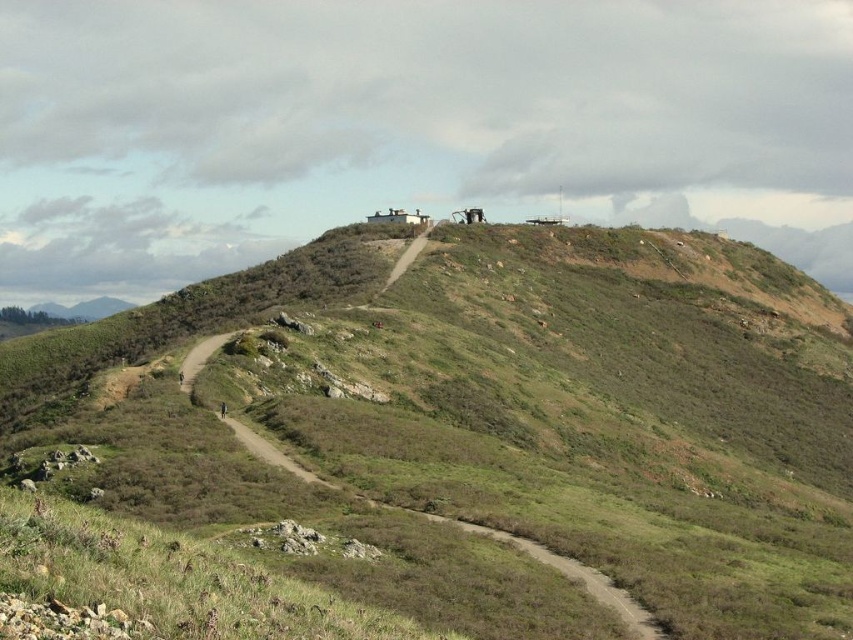
Question: Estimate the real-world distances between objects in this image. Which object is closer to the brown leather jacket at lower left?

Choices:
 (A) green grassy hill at upper center
 (B) black fabric person at lower left

Answer: (B)

Question: Which object is the farthest from the green grassy hill at upper center?

Choices:
 (A) black fabric person at lower left
 (B) brown dirt trail at center

Answer: (A)

Question: Which object is the farthest from the brown leather jacket at lower left?

Choices:
 (A) green grassy hill at upper center
 (B) black fabric person at lower left

Answer: (A)

Question: Does green grassy hill at upper center lie behind brown leather jacket at lower left?

Choices:
 (A) yes
 (B) no

Answer: (B)

Question: From the image, what is the correct spatial relationship of green grassy hill at upper center in relation to black fabric person at lower left?

Choices:
 (A) right
 (B) left

Answer: (A)

Question: Does black fabric person at lower left have a lesser width compared to brown leather jacket at lower left?

Choices:
 (A) no
 (B) yes

Answer: (A)